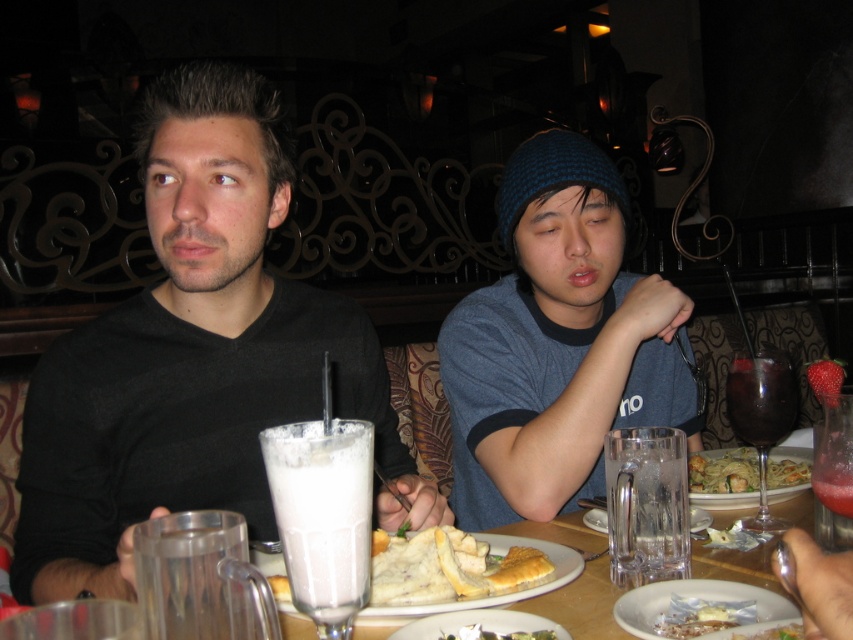
You are a waiter in a restaurant. You need to deliver a dessert to the customer sitting at the table. The customer requested the dessert to be placed on the left side of the plate. Looking at the scene, can you confirm if the white creamy dessert at center is already positioned to the left of the matte glass plate at center?

Yes, the white creamy dessert at center is already positioned to the left of the matte glass plate at center, as stated in the description.

You are a waiter in a restaurant and need to deliver a drink to the blue knit cap at center. The coordinates given are in a normalized system where the bottom left corner is the origin. What direction should you move from the point at coordinates point (556, 342) to reach the blue knit cap at center?

The point at coordinates point (556, 342) already indicates the location of the blue knit cap at center, so you don not need to move in any direction.